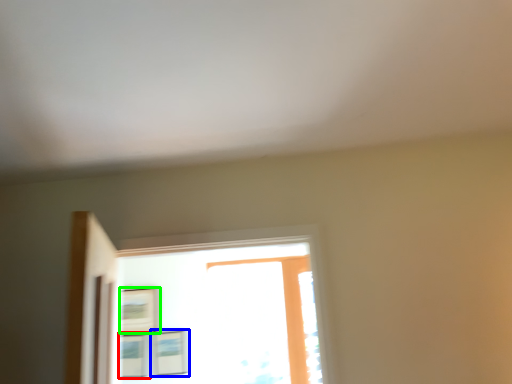
Question: Considering the real-world distances, which object is closest to picture frame (highlighted by a red box)? picture frame (highlighted by a blue box) or picture frame (highlighted by a green box).

Choices:
 (A) picture frame
 (B) picture frame

Answer: (A)